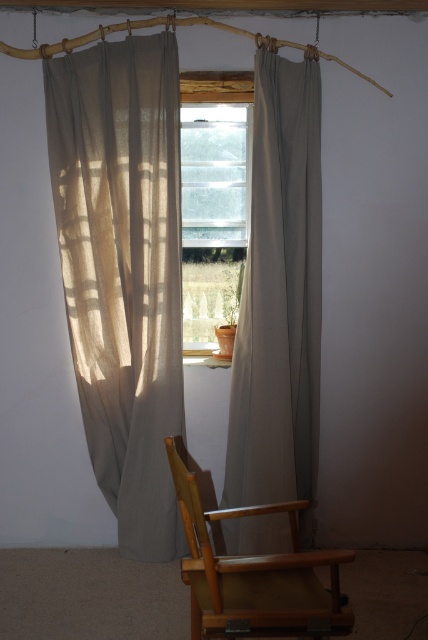
You are sitting in the light brown wooden armchair at lower center and want to look outside through the clear glass window at center. Can you see the window clearly from your current position?

The light brown wooden armchair at lower center is positioned on the right side of clear glass window at center, so yes, you can see the window clearly from your current position.

Based on the photo, you are moving a large sofa that is 1.5 meters wide into the room. The sofa is currently positioned near the entrance and needs to be moved to the area where the light brown wooden armchair at lower center is located. Is there enough space between the clear glass window at center and the existing furniture to maneuver the sofa through?

The light brown wooden armchair at lower center might be wider than the clear glass window at center, so there may not be sufficient space to maneuver the 1.5 meter wide sofa through the area between them. It is recommended to check the exact dimensions before attempting to move the sofa.

You are standing in the room and want to know which of the two points, point (121, 532) or point (225, 106), is closer to you. Based on the image, which point is nearer?

Point (121, 532) is in front of point (225, 106), so it is closer to you.